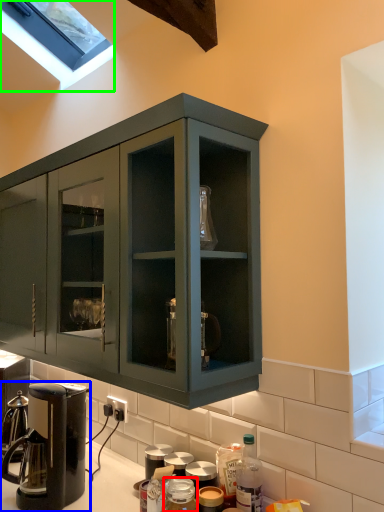
Question: Which object is the closest to the bottle (highlighted by a red box)? Choose among these: coffee maker (highlighted by a blue box) or window (highlighted by a green box).

Choices:
 (A) coffee maker
 (B) window

Answer: (A)